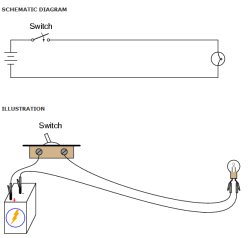
At what (x,y) coordinates should I click in order to perform the action: click on light bulb. Please return your answer as a coordinate pair (x, y). Looking at the image, I should click on (233, 164), (234, 170).